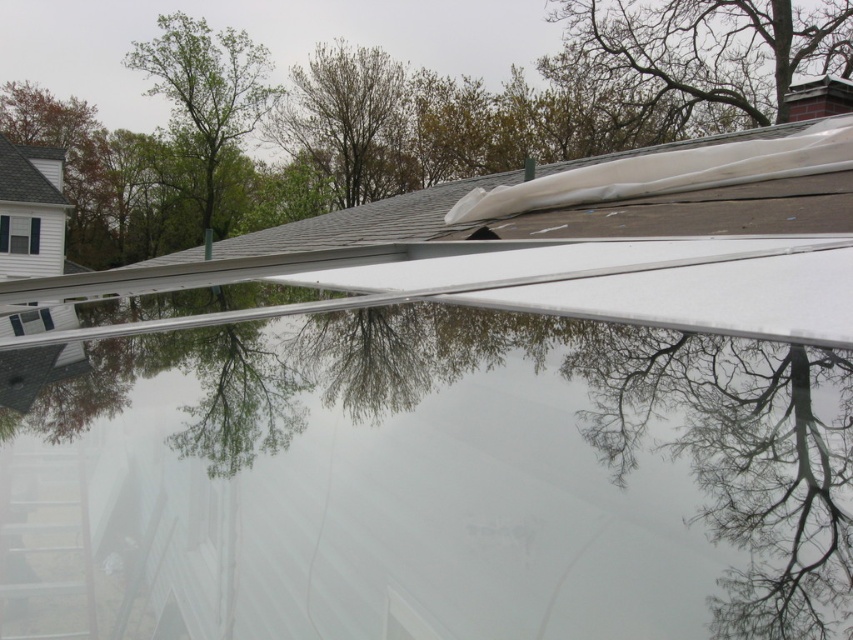
Is the position of green leafy tree at upper left less distant than that of gray shingles at upper center?

No, it is behind gray shingles at upper center.

Is green leafy tree at upper left smaller than gray shingles at upper center?

No, green leafy tree at upper left is not smaller than gray shingles at upper center.

Is point (204, 205) less distant than point (447, 209)?

No, it is behind (447, 209).

The height and width of the screenshot is (640, 853). I want to click on green leafy tree at upper left, so click(207, 84).

Can you confirm if gray shingles at upper center is smaller than gray shingles at upper left?

Incorrect, gray shingles at upper center is not smaller in size than gray shingles at upper left.

Between point (670, 141) and point (32, 173), which one is positioned in front?

Point (670, 141) is more forward.

Identify the location of gray shingles at upper center. The height and width of the screenshot is (640, 853). (364, 221).

Find the location of a particular element. This screenshot has height=640, width=853. gray shingles at upper center is located at coordinates (364, 221).

Does green leafy tree at upper left appear over gray shingles at upper left?

Correct, green leafy tree at upper left is located above gray shingles at upper left.

Based on the photo, which of these two, green leafy tree at upper left or gray shingles at upper left, stands taller?

Standing taller between the two is green leafy tree at upper left.

Measure the distance between point (x=196, y=70) and camera.

Point (x=196, y=70) and camera are 40.71 meters apart from each other.

Locate an element on the screen. This screenshot has width=853, height=640. green leafy tree at upper left is located at coordinates (207, 84).